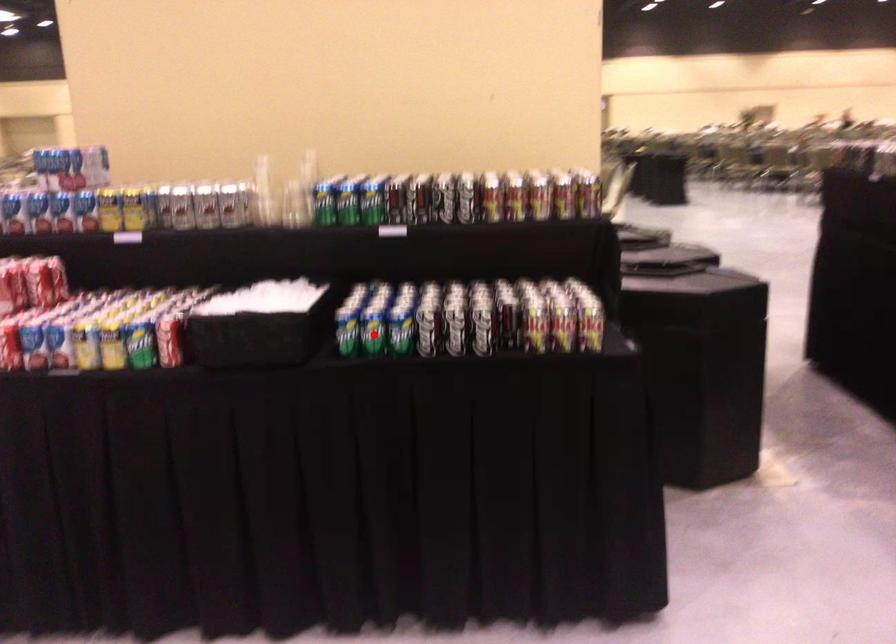
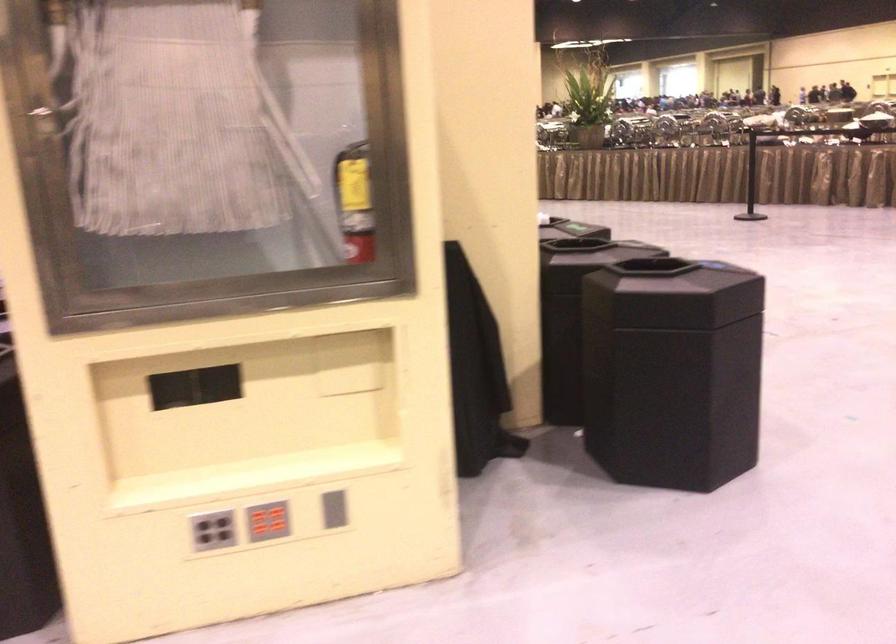
Question: I am providing you with two images of the same scene from different viewpoints. A red point is marked on the first image. Is the red point's position out of view in image 2?

Choices:
 (A) Yes
 (B) No

Answer: (A)